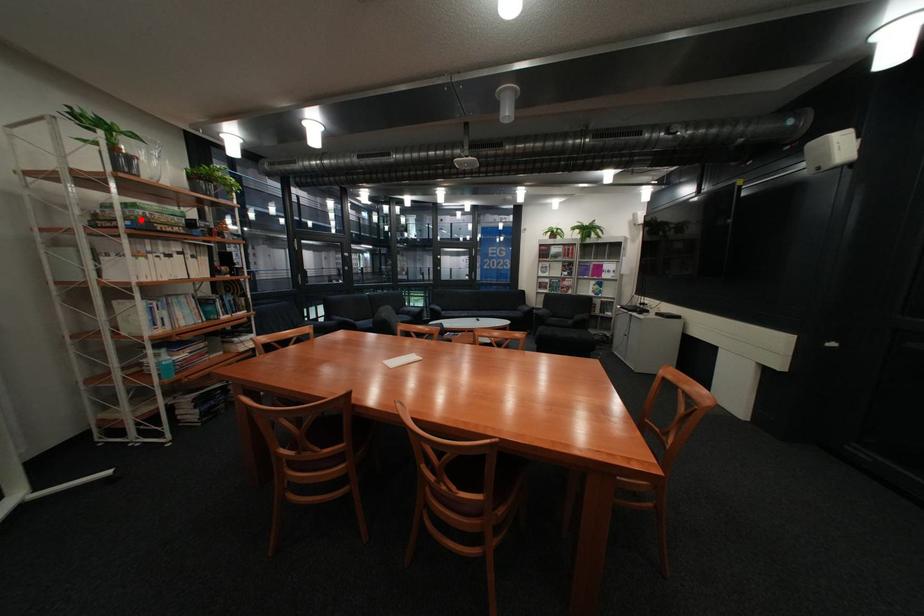
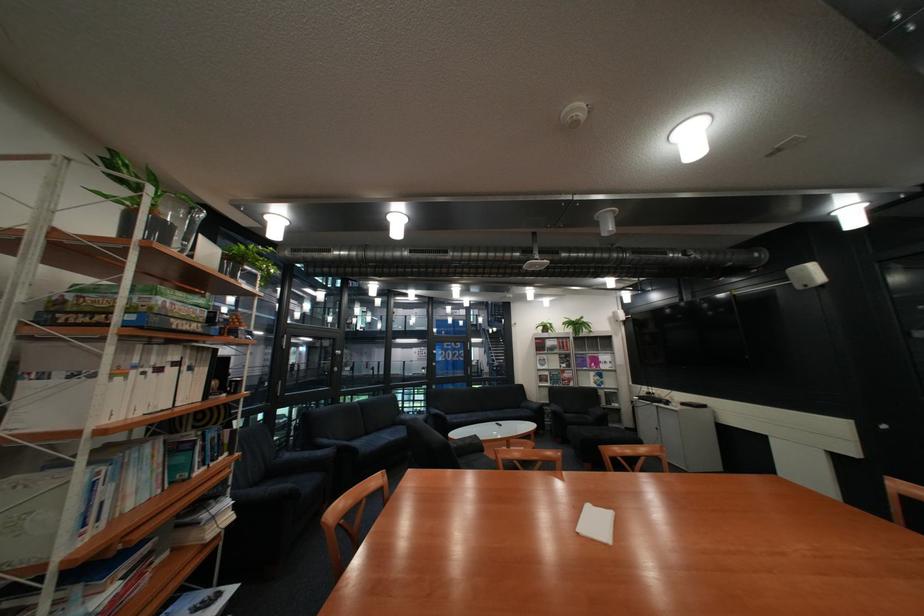
Locate, in the second image, the point that corresponds to the highlighted location in the first image.

(141, 312)